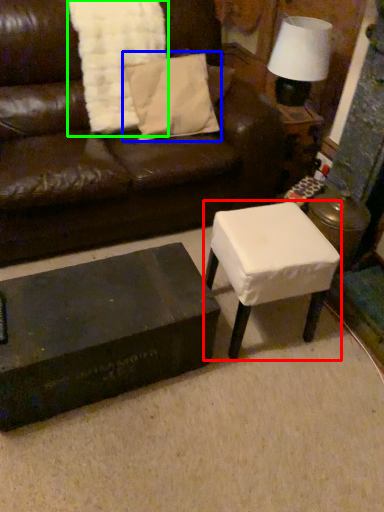
Question: Estimate the real-world distances between objects in this image. Which object is farther from table (highlighted by a red box), pillow (highlighted by a blue box) or blanket (highlighted by a green box)?

Choices:
 (A) pillow
 (B) blanket

Answer: (B)